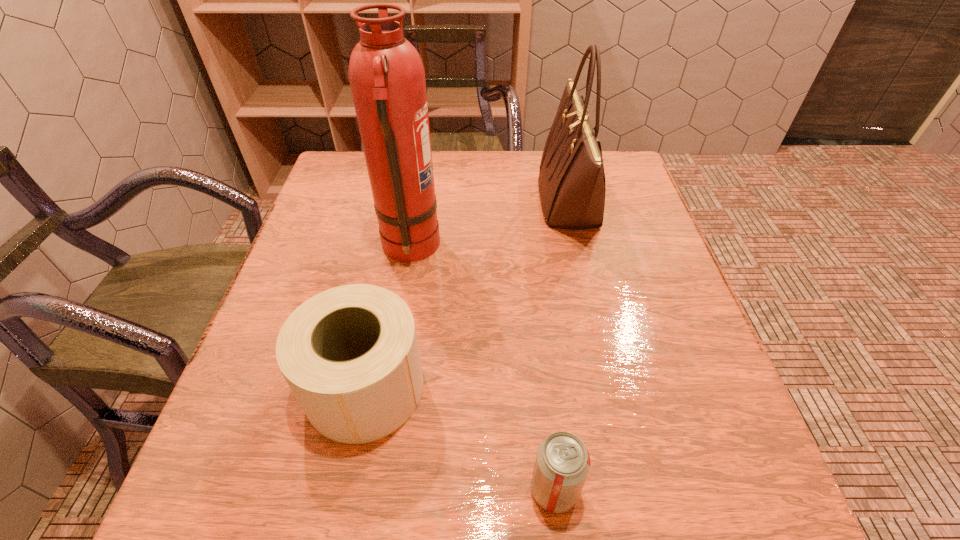
Locate an element on the screen. vacant space located on the front-facing side of the third shortest object is located at coordinates (425, 201).

Image resolution: width=960 pixels, height=540 pixels. I want to click on free space located 0.110m on the front of the second shortest object, so click(338, 523).

I want to click on blank space located 0.060m on the left of the third object from left to right, so tap(489, 490).

You are a GUI agent. You are given a task and a screenshot of the screen. Output one action in this format:
    pyautogui.click(x=<x>, y=<y>)
    Task: Click on the object located in the far edge section of the desktop
    The image size is (960, 540).
    Given the screenshot: What is the action you would take?
    pyautogui.click(x=572, y=187)

The height and width of the screenshot is (540, 960). Identify the location of object present at the near edge. (562, 464).

At what (x,y) coordinates should I click in order to perform the action: click on object present at the left edge. Please return your answer as a coordinate pair (x, y). The height and width of the screenshot is (540, 960). Looking at the image, I should click on (350, 355).

Locate an element on the screen. This screenshot has width=960, height=540. object present at the right edge is located at coordinates (572, 187).

You are a GUI agent. You are given a task and a screenshot of the screen. Output one action in this format:
    pyautogui.click(x=<x>, y=<y>)
    Task: Click on the object located at the far right corner
    This screenshot has height=540, width=960.
    Given the screenshot: What is the action you would take?
    pyautogui.click(x=572, y=187)

In the image, there is a desktop. What are the coordinates of `free space at the far edge` in the screenshot? It's located at (519, 163).

Locate an element on the screen. The image size is (960, 540). vacant region at the near edge is located at coordinates (501, 468).